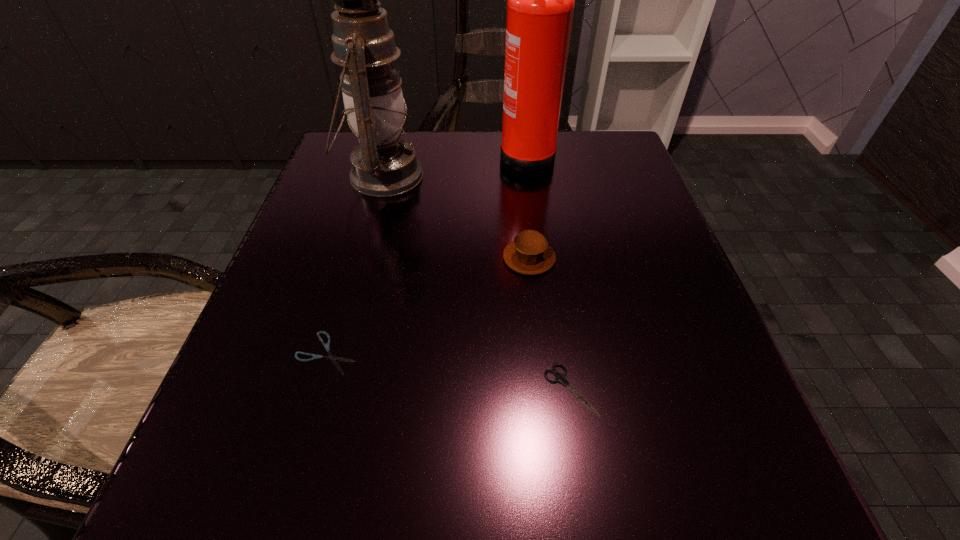
The width and height of the screenshot is (960, 540). In order to click on vacant space at the far edge of the desktop in this screenshot , I will do `click(461, 177)`.

Where is `vacant area at the near edge`? vacant area at the near edge is located at coordinates (488, 497).

This screenshot has width=960, height=540. What are the coordinates of `vacant space at the left edge of the desktop` in the screenshot? It's located at (294, 443).

The image size is (960, 540). In the image, there is a desktop. Identify the location of vacant region at the right edge. (660, 251).

Where is `vacant space at the far left corner`? The image size is (960, 540). vacant space at the far left corner is located at coordinates (326, 168).

Image resolution: width=960 pixels, height=540 pixels. In the image, there is a desktop. In order to click on free space at the far right corner in this screenshot , I will do `click(566, 144)`.

What are the coordinates of `free space at the near right corner of the desktop` in the screenshot? It's located at (660, 488).

You are a GUI agent. You are given a task and a screenshot of the screen. Output one action in this format:
    pyautogui.click(x=<x>, y=<y>)
    Task: Click on the free space between the second tallest object and the third shortest object
    The height and width of the screenshot is (540, 960).
    Given the screenshot: What is the action you would take?
    pyautogui.click(x=456, y=217)

This screenshot has width=960, height=540. I want to click on free area in between the taller shears and the oil lamp, so click(x=476, y=282).

Locate an element on the screen. The height and width of the screenshot is (540, 960). free space between the right shears and the tallest object is located at coordinates (548, 272).